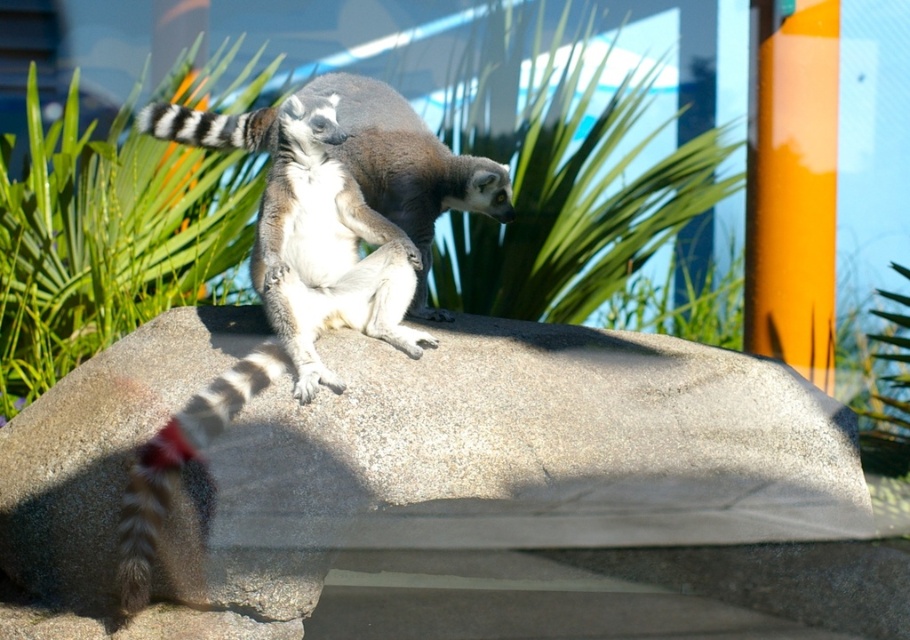
Does ring-tailed lemur at center appear over black and white striped tail at upper left?

Actually, ring-tailed lemur at center is below black and white striped tail at upper left.

Is point (393, 269) in front of point (180, 116)?

Yes, it is in front of point (180, 116).

Image resolution: width=910 pixels, height=640 pixels. In order to click on ring-tailed lemur at center in this screenshot , I will do `click(319, 273)`.

Between gray granite boulder at center and black and white striped tail at upper left, which one has less height?

black and white striped tail at upper left

Does gray granite boulder at center appear on the left side of black and white striped tail at upper left?

In fact, gray granite boulder at center is to the right of black and white striped tail at upper left.

Image resolution: width=910 pixels, height=640 pixels. What do you see at coordinates (507, 460) in the screenshot? I see `gray granite boulder at center` at bounding box center [507, 460].

Identify the location of gray granite boulder at center. Image resolution: width=910 pixels, height=640 pixels. (507, 460).

Measure the distance from gray granite boulder at center to ring-tailed lemur at center.

gray granite boulder at center and ring-tailed lemur at center are 13.78 inches apart from each other.

Between gray granite boulder at center and ring-tailed lemur at center, which one has more height?

With more height is ring-tailed lemur at center.

Find the location of a particular element. The height and width of the screenshot is (640, 910). gray granite boulder at center is located at coordinates (507, 460).